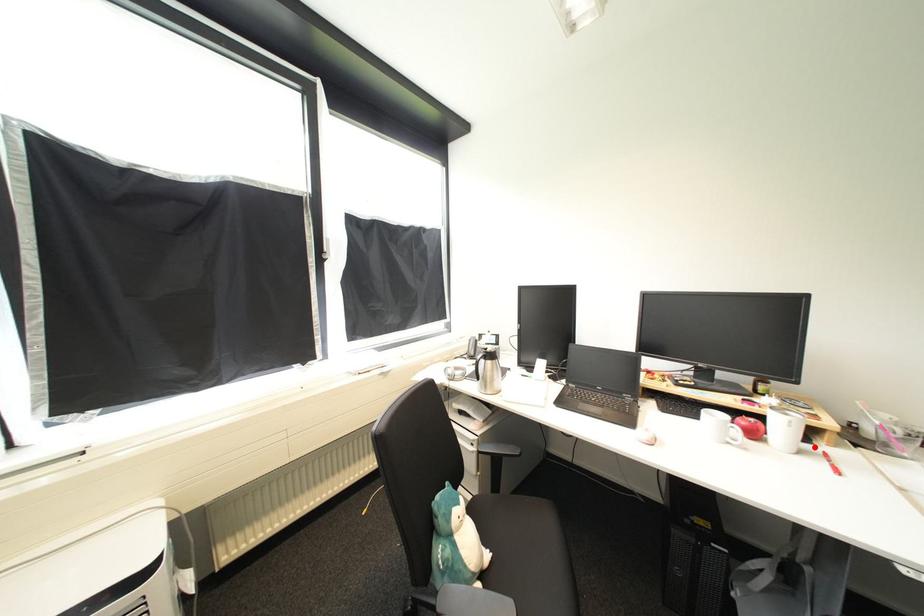
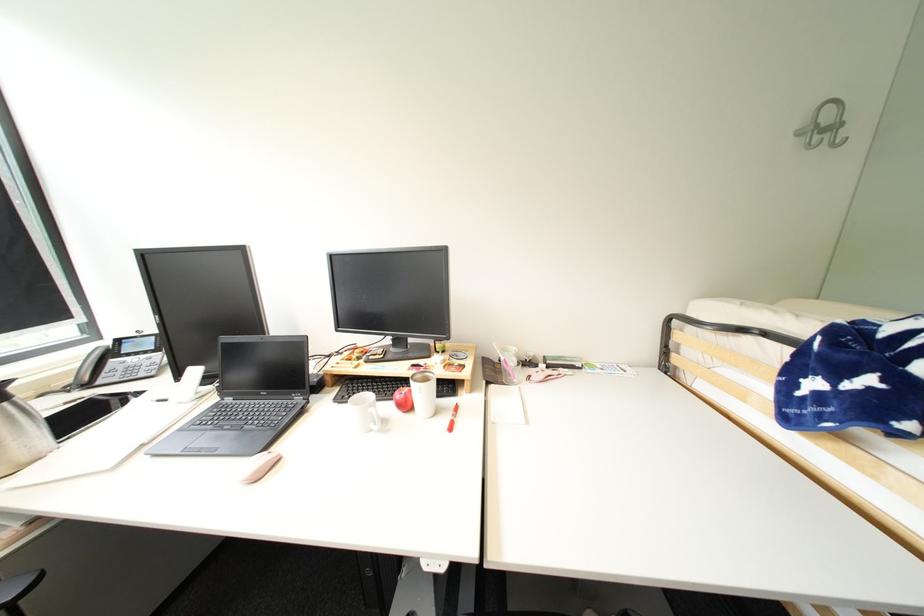
In the second image, find the point that corresponds to the highlighted location in the first image.

(456, 402)